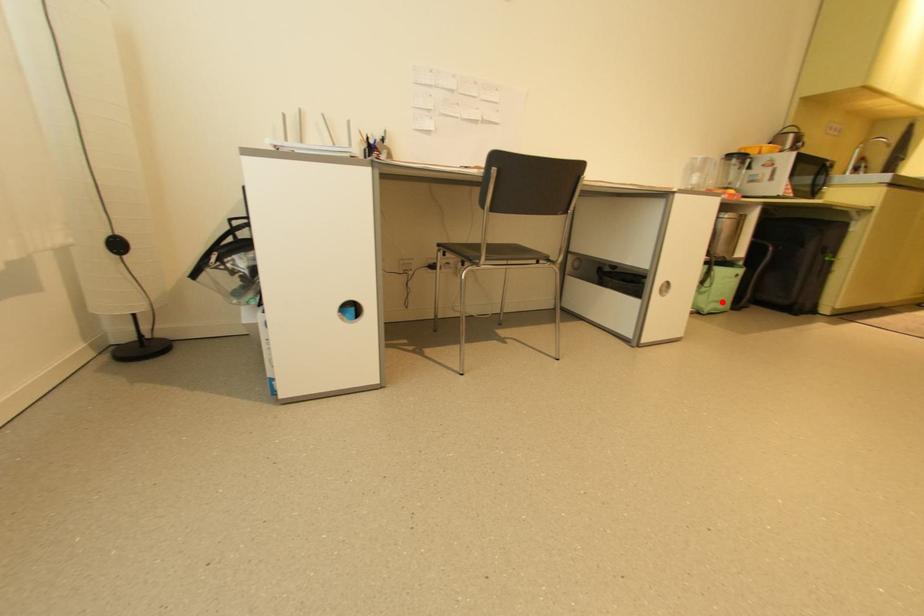
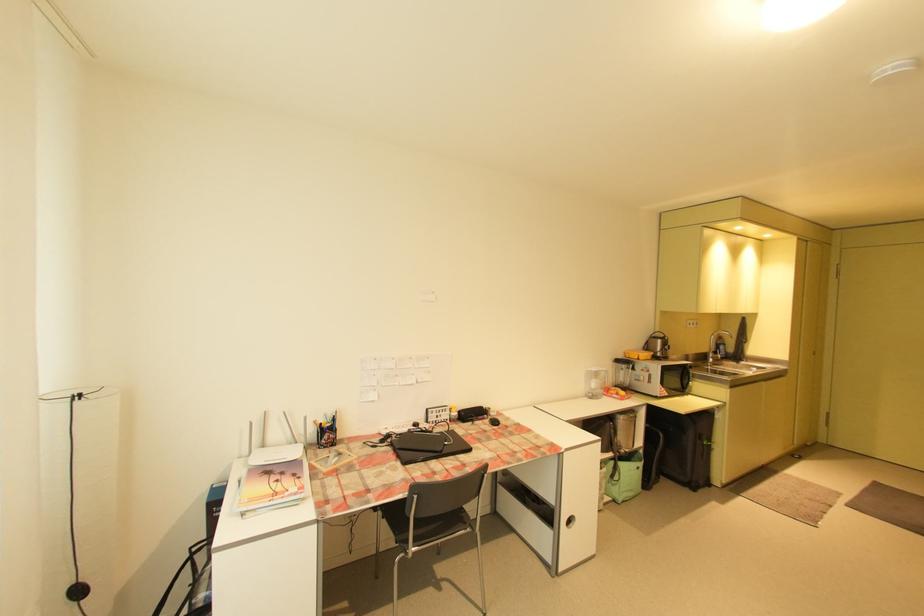
The point at the highlighted location is marked in the first image. Where is the corresponding point in the second image?

(634, 492)